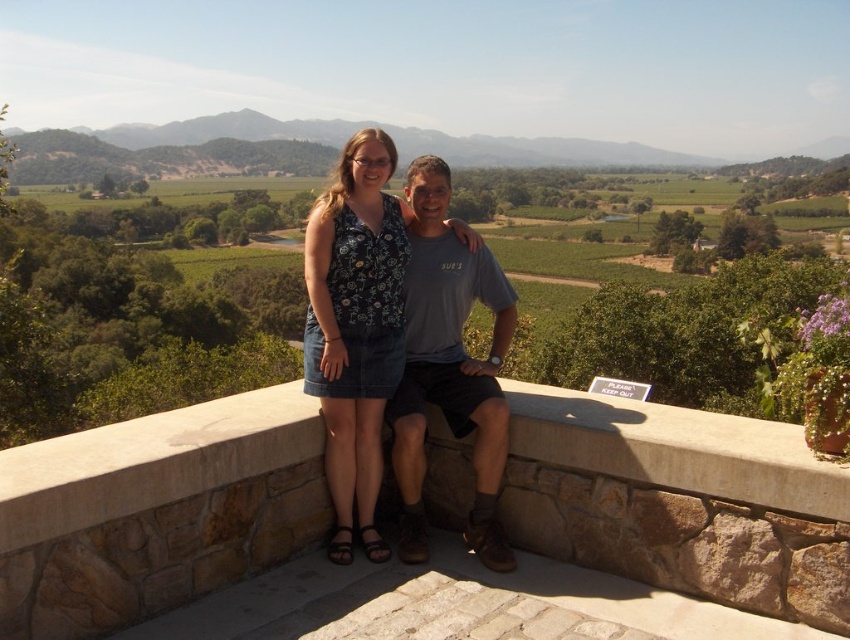
Which is above, stone ledge at center or denim skirt at center?

Positioned higher is denim skirt at center.

Is stone ledge at center below denim skirt at center?

Yes.

Locate an element on the screen. This screenshot has width=850, height=640. stone ledge at center is located at coordinates (156, 512).

Can you confirm if stone ledge at center is positioned to the right of gray cotton t-shirt at center?

No, stone ledge at center is not to the right of gray cotton t-shirt at center.

Between stone ledge at center and gray cotton t-shirt at center, which one appears on the right side from the viewer's perspective?

gray cotton t-shirt at center

Between point (295, 433) and point (459, 292), which one is positioned in front?

Positioned in front is point (295, 433).

Identify the location of stone ledge at center. The width and height of the screenshot is (850, 640). (156, 512).

Can you confirm if denim skirt at center is wider than gray cotton t-shirt at center?

Indeed, denim skirt at center has a greater width compared to gray cotton t-shirt at center.

Between point (318, 240) and point (480, 444), which one is positioned in front?

Point (480, 444)

Image resolution: width=850 pixels, height=640 pixels. I want to click on denim skirt at center, so click(355, 328).